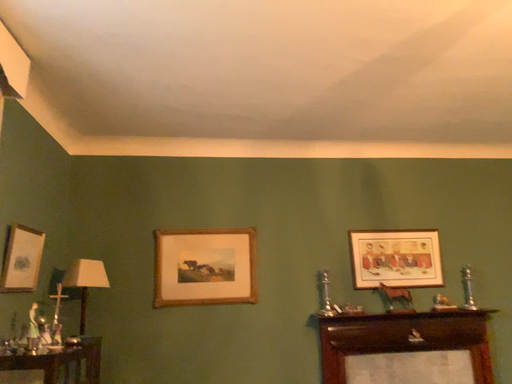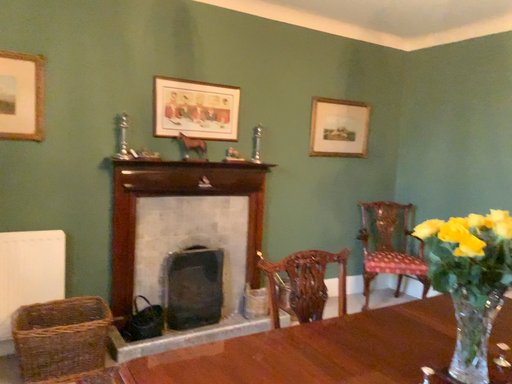
Question: How did the camera likely rotate when shooting the video?

Choices:
 (A) rotated downward
 (B) rotated upward

Answer: (A)